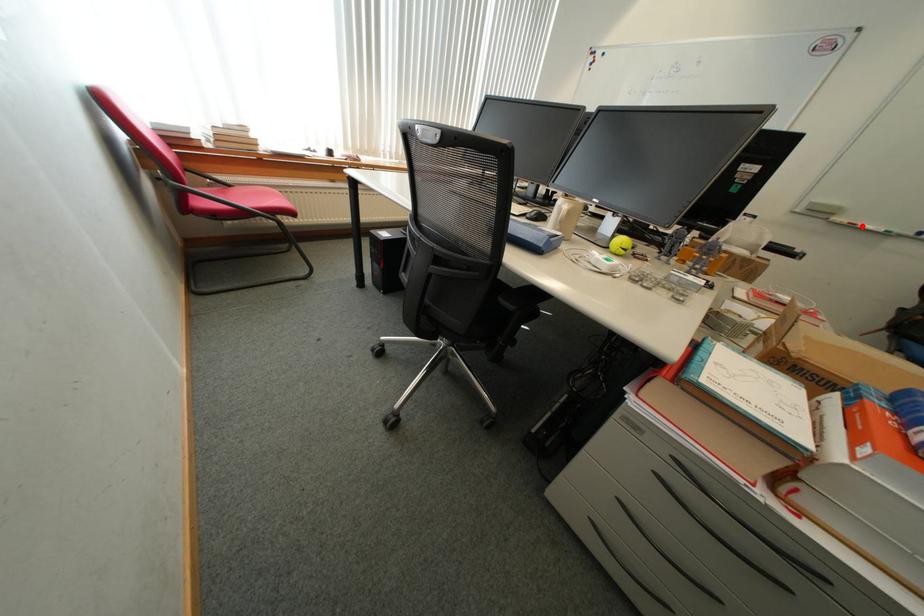
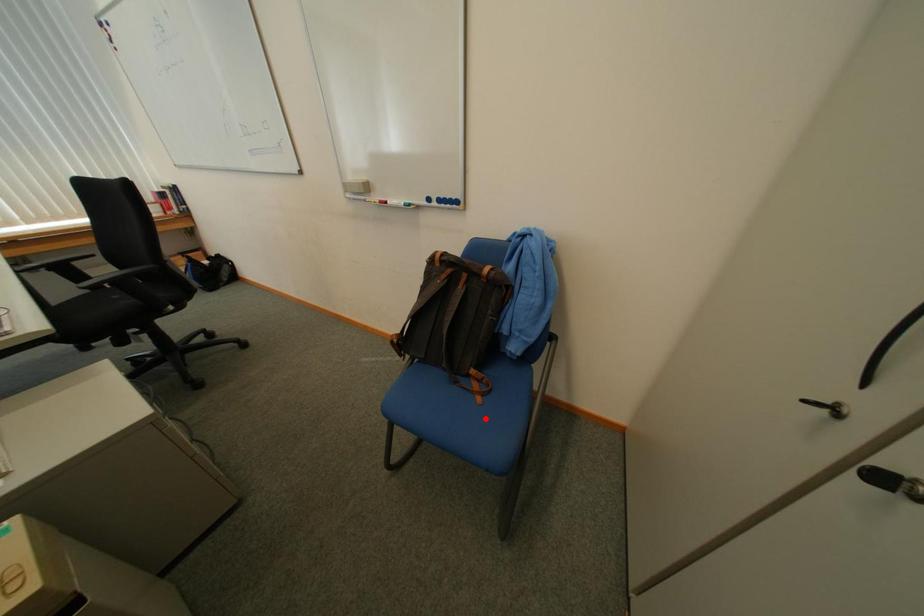
I am providing you with two images of the same scene from different viewpoints. A red point is marked on the first image and another point is marked on the second image. Do the highlighted points in image1 and image2 indicate the same real-world spot?

No